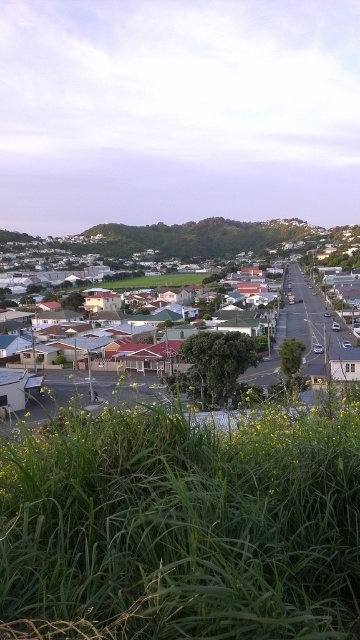
Who is more distant from viewer, (330, 256) or (250, 237)?

The point (250, 237) is more distant.

Does point (294, 285) come closer to viewer compared to point (273, 244)?

Yes.

The height and width of the screenshot is (640, 360). I want to click on matte white houses at center, so click(x=316, y=284).

Between green grassy hillside at center and red tiled roofs at center, which one is positioned lower?

red tiled roofs at center is below.

Can you confirm if green grassy hillside at center is positioned below red tiled roofs at center?

Actually, green grassy hillside at center is above red tiled roofs at center.

This screenshot has width=360, height=640. I want to click on green grassy hillside at center, so click(x=195, y=237).

Identify the location of green grassy hillside at center. (195, 237).

How far apart are matte white houses at center and red tiled roofs at center?

Result: matte white houses at center is 348.58 feet from red tiled roofs at center.

The height and width of the screenshot is (640, 360). I want to click on matte white houses at center, so click(x=316, y=284).